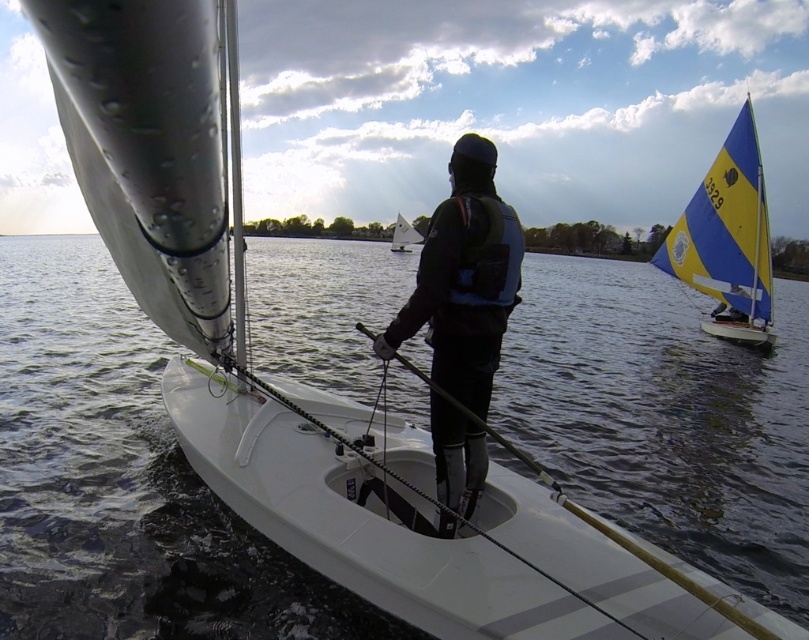
Between dark blue wetsuit at center and white matte sailboat at center, which one is positioned lower?

dark blue wetsuit at center

Does dark blue wetsuit at center come in front of white matte sailboat at center?

Yes, dark blue wetsuit at center is in front of white matte sailboat at center.

This screenshot has width=809, height=640. Identify the location of dark blue wetsuit at center. (464, 278).

Identify the location of dark blue wetsuit at center. (464, 278).

Is point (409, 321) behind point (709, 269)?

No.

Can you confirm if dark blue wetsuit at center is thinner than blue/yellow sailboat at right?

Yes, dark blue wetsuit at center is thinner than blue/yellow sailboat at right.

Between point (409, 310) and point (719, 337), which one is positioned behind?

Positioned behind is point (719, 337).

At what (x,y) coordinates should I click in order to perform the action: click on dark blue wetsuit at center. Please return your answer as a coordinate pair (x, y). The image size is (809, 640). Looking at the image, I should click on (464, 278).

Does point (733, 227) lie behind point (394, 252)?

No, (733, 227) is in front of (394, 252).

At what (x,y) coordinates should I click in order to perform the action: click on blue/yellow sailboat at right. Please return your answer as a coordinate pair (x, y). The image size is (809, 640). Looking at the image, I should click on (727, 241).